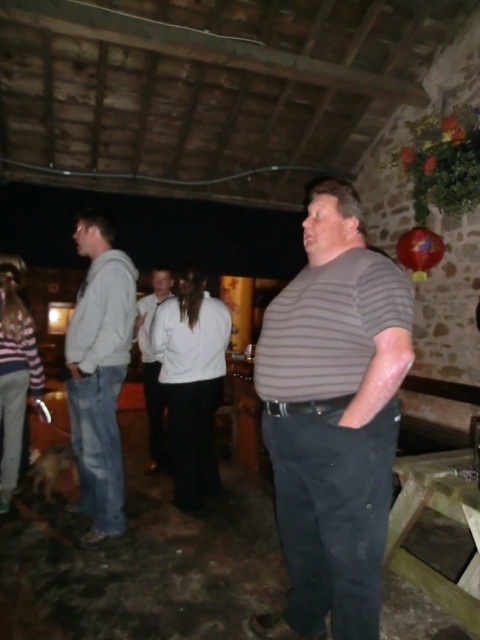
In the image of a rustic indoor setting with stone walls and wooden beams, where can you locate the gray striped shirt at center?

The gray striped shirt at center is located at point 0.655 on the x axis and 0.694 on the y axis.

What is the color of the hoodie located at point (99, 372)?

The hoodie at point (99, 372) is light gray.

You are planning to take a photo of two people wearing the gray striped shirt at center and the light gray hoodie at left. Which of their clothing items appears narrower in the photo?

The gray striped shirt at center appears narrower compared to the light gray hoodie at left because it has a lesser width.